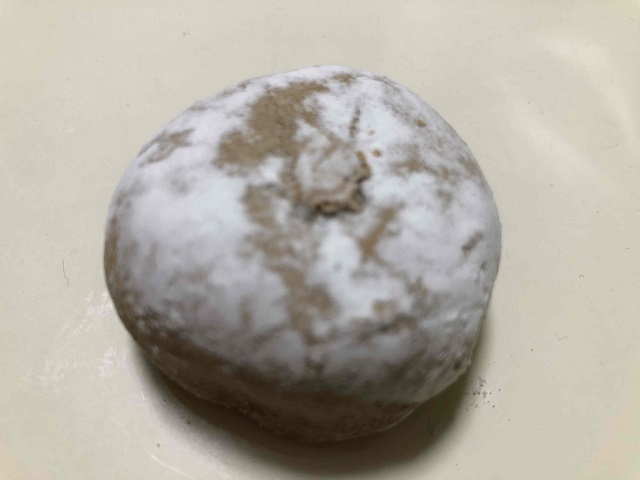
Where is `light reflection on table`? The image size is (640, 480). light reflection on table is located at coordinates point(534,127), point(596,55).